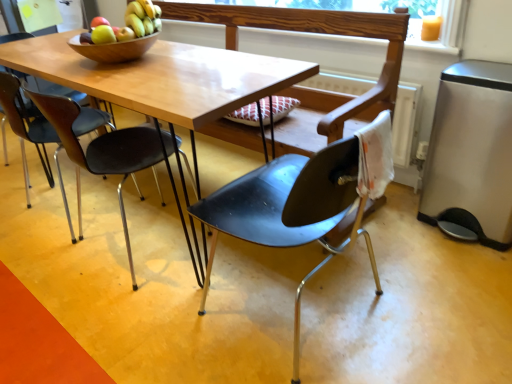
Question: Considering the relative sizes of wooden frame at upper center and matte black chair at left, the 1th chair when ordered from left to right, in the image provided, is wooden frame at upper center bigger than matte black chair at left, the 1th chair when ordered from left to right,?

Choices:
 (A) no
 (B) yes

Answer: (A)

Question: Does wooden frame at upper center turn towards matte black chair at left, acting as the 3th chair starting from the right?

Choices:
 (A) no
 (B) yes

Answer: (A)

Question: Does wooden frame at upper center have a greater height compared to matte black chair at left, acting as the 3th chair starting from the right?

Choices:
 (A) no
 (B) yes

Answer: (A)

Question: Is there a large distance between wooden frame at upper center and matte black chair at left, the 1th chair when ordered from left to right?

Choices:
 (A) yes
 (B) no

Answer: (A)

Question: Is wooden frame at upper center looking in the opposite direction of matte black chair at left, the 1th chair when ordered from left to right?

Choices:
 (A) no
 (B) yes

Answer: (A)

Question: Is wooden frame at upper center smaller than matte black chair at left, the 1th chair when ordered from left to right?

Choices:
 (A) no
 (B) yes

Answer: (B)

Question: Does matte black chair at left, the 1th chair when ordered from left to right, have a greater width compared to black plastic chair at left, which appears as the second chair when viewed from the right?

Choices:
 (A) no
 (B) yes

Answer: (B)

Question: From the image's perspective, is matte black chair at left, the 1th chair when ordered from left to right, above black plastic chair at left, the 2th chair viewed from the left?

Choices:
 (A) yes
 (B) no

Answer: (A)

Question: Can you confirm if matte black chair at left, the 1th chair when ordered from left to right, is thinner than black plastic chair at left, the 2th chair viewed from the left?

Choices:
 (A) no
 (B) yes

Answer: (A)

Question: Would you say matte black chair at left, the 1th chair when ordered from left to right, is outside black plastic chair at left, the 2th chair viewed from the left?

Choices:
 (A) yes
 (B) no

Answer: (A)

Question: Considering the relative sizes of matte black chair at left, acting as the 3th chair starting from the right, and black plastic chair at left, the 2th chair viewed from the left, in the image provided, is matte black chair at left, acting as the 3th chair starting from the right, smaller than black plastic chair at left, the 2th chair viewed from the left,?

Choices:
 (A) yes
 (B) no

Answer: (B)

Question: Is black plastic chair at left, the 2th chair viewed from the left, at the back of matte black chair at left, the 1th chair when ordered from left to right?

Choices:
 (A) yes
 (B) no

Answer: (B)

Question: Is wooden frame at upper center looking in the opposite direction of black plastic chair at left, which appears as the second chair when viewed from the right?

Choices:
 (A) yes
 (B) no

Answer: (B)